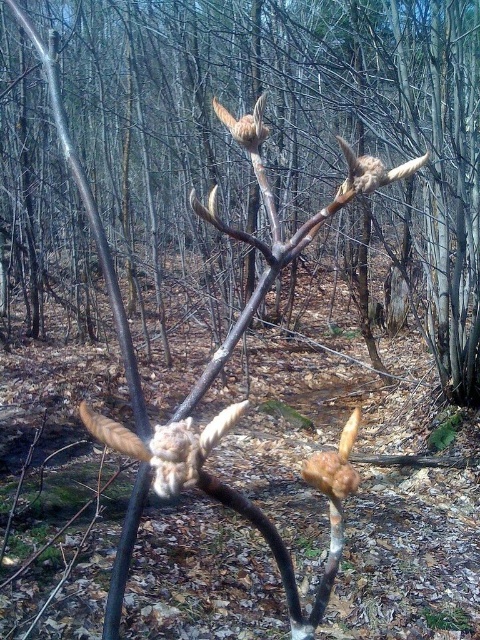
Where is `brown rough bark at center`? The image size is (480, 640). brown rough bark at center is located at coordinates (421, 147).

Which is below, brown rough bark at center or fuzzy brown branch at center?

fuzzy brown branch at center is lower down.

Between point (405, 144) and point (90, 426), which one is positioned in front?

Point (90, 426) is in front.

This screenshot has height=640, width=480. What are the coordinates of `brown rough bark at center` in the screenshot? It's located at (421, 147).

What do you see at coordinates (372, 170) in the screenshot? I see `brown fuzzy branch at upper center` at bounding box center [372, 170].

Is point (363, 164) more distant than point (230, 122)?

That is False.

Is point (368, 180) farther from viewer compared to point (256, 129)?

No.

Identify the location of brown fuzzy branch at upper center. (372, 170).

How far apart are fuzzy brown branch at center and brown fuzzy branch at upper center?

fuzzy brown branch at center is 12.17 inches from brown fuzzy branch at upper center.

Which is behind, point (109, 419) or point (423, 160)?

The point (109, 419) is behind.

Identify the location of fuzzy brown branch at center. The image size is (480, 640). (166, 444).